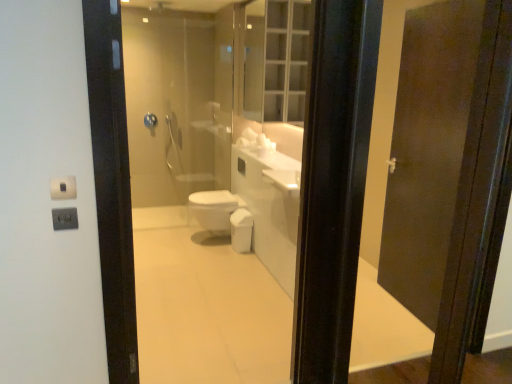
Question: Is blue plastic towel bar at upper center at the left side of clear glass medicine cabinet at upper center?

Choices:
 (A) no
 (B) yes

Answer: (B)

Question: Is blue plastic towel bar at upper center further to the viewer compared to clear glass medicine cabinet at upper center?

Choices:
 (A) yes
 (B) no

Answer: (A)

Question: From the image's perspective, is blue plastic towel bar at upper center beneath clear glass medicine cabinet at upper center?

Choices:
 (A) yes
 (B) no

Answer: (A)

Question: Is blue plastic towel bar at upper center looking in the opposite direction of clear glass medicine cabinet at upper center?

Choices:
 (A) no
 (B) yes

Answer: (A)

Question: From the image's perspective, is blue plastic towel bar at upper center over clear glass medicine cabinet at upper center?

Choices:
 (A) yes
 (B) no

Answer: (B)

Question: Considering the positions of blue plastic towel bar at upper center and white glossy bidet at center in the image, is blue plastic towel bar at upper center bigger or smaller than white glossy bidet at center?

Choices:
 (A) big
 (B) small

Answer: (B)

Question: From the image's perspective, is blue plastic towel bar at upper center located above or below white glossy bidet at center?

Choices:
 (A) below
 (B) above

Answer: (B)

Question: Is point (144, 117) positioned closer to the camera than point (212, 230)?

Choices:
 (A) closer
 (B) farther

Answer: (B)

Question: From their relative heights in the image, would you say blue plastic towel bar at upper center is taller or shorter than white glossy bidet at center?

Choices:
 (A) short
 (B) tall

Answer: (A)

Question: Is point (221, 192) closer or farther from the camera than point (147, 127)?

Choices:
 (A) farther
 (B) closer

Answer: (B)

Question: Relative to blue plastic towel bar at upper center, is white glossy bidet at center in front or behind?

Choices:
 (A) behind
 (B) front

Answer: (B)

Question: Would you say white glossy bidet at center is inside or outside blue plastic towel bar at upper center?

Choices:
 (A) inside
 (B) outside

Answer: (B)

Question: In terms of width, does white glossy bidet at center look wider or thinner when compared to blue plastic towel bar at upper center?

Choices:
 (A) wide
 (B) thin

Answer: (A)

Question: Is white glossy bidet at center inside or outside of clear glass medicine cabinet at upper center?

Choices:
 (A) inside
 (B) outside

Answer: (B)

Question: In terms of width, does white glossy bidet at center look wider or thinner when compared to clear glass medicine cabinet at upper center?

Choices:
 (A) thin
 (B) wide

Answer: (B)